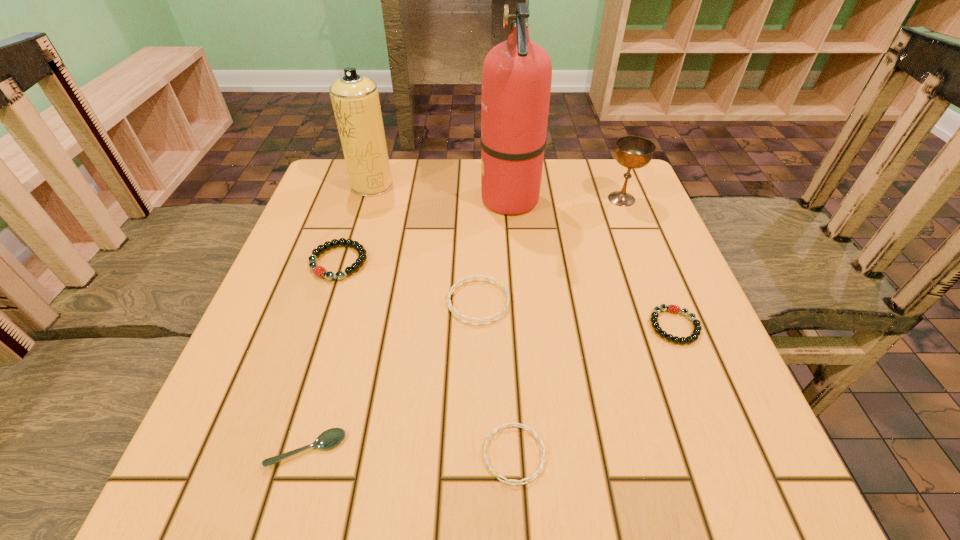
Where is `free space between the rightmost bracelet and the chalice`? The image size is (960, 540). free space between the rightmost bracelet and the chalice is located at coordinates (648, 262).

The height and width of the screenshot is (540, 960). I want to click on vacant point located between the sixth shortest object and the smaller blue bracelet, so click(568, 327).

At what (x,y) coordinates should I click in order to perform the action: click on free space between the farther black bracelet and the soupspoon. Please return your answer as a coordinate pair (x, y). Looking at the image, I should click on (323, 356).

Point out which object is positioned as the nearest to the soupspoon. Please provide its 2D coordinates. Your answer should be formatted as a tuple, i.e. [(x, y)], where the tuple contains the x and y coordinates of a point satisfying the conditions above.

[(523, 426)]

Where is `object that is the seventh nearest to the red fire extinguisher`? object that is the seventh nearest to the red fire extinguisher is located at coordinates (330, 438).

Locate an element on the screen. This screenshot has width=960, height=540. bracelet that is the nearest to the smaller black bracelet is located at coordinates [454, 286].

Locate an element on the screen. This screenshot has height=540, width=960. bracelet that is the third closest to the fire extinguisher is located at coordinates (696, 332).

This screenshot has width=960, height=540. I want to click on vacant region that satisfies the following two spatial constraints: 1. on the front side of the soupspoon; 2. on the right side of the second tallest object, so click(291, 449).

Locate an element on the screen. free spot that satisfies the following two spatial constraints: 1. on the back side of the chalice; 2. on the side of the fire extinguisher with the nozzle and handle is located at coordinates (621, 199).

You are a GUI agent. You are given a task and a screenshot of the screen. Output one action in this format:
    pyautogui.click(x=<x>, y=<y>)
    Task: Click on the vacant point that satisfies the following two spatial constraints: 1. on the side of the red fire extinguisher with the nozzle and handle; 2. on the front side of the leftmost bracelet
    Image resolution: width=960 pixels, height=540 pixels.
    Given the screenshot: What is the action you would take?
    pyautogui.click(x=516, y=262)